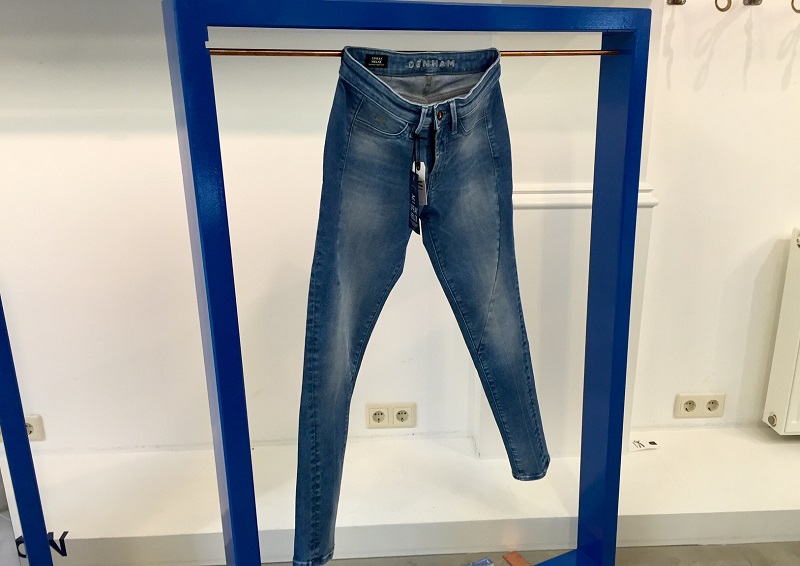
Where is `rack`? Image resolution: width=800 pixels, height=566 pixels. rack is located at coordinates click(x=202, y=362).